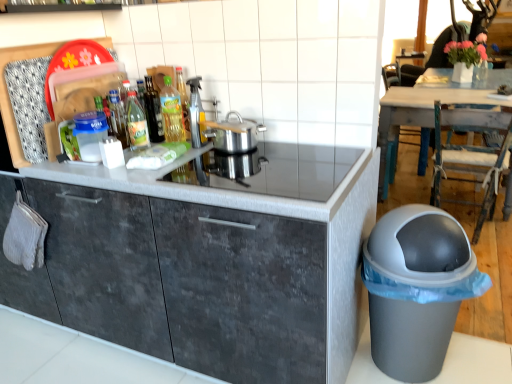
Question: Is rustic wood chair at right, the 2th chair in the back-to-front sequence, positioned with its back to green glass bottle at center, placed as the 3th bottle when sorted from left to right?

Choices:
 (A) no
 (B) yes

Answer: (A)

Question: From a real-world perspective, is rustic wood chair at right, the 2th chair in the back-to-front sequence, positioned under green glass bottle at center, placed as the 1th bottle when sorted from right to left, based on gravity?

Choices:
 (A) yes
 (B) no

Answer: (A)

Question: Is green glass bottle at center, placed as the 3th bottle when sorted from left to right, surrounded by rustic wood chair at right, the 2th chair in the back-to-front sequence?

Choices:
 (A) yes
 (B) no

Answer: (B)

Question: From the image's perspective, is rustic wood chair at right, the 2th chair in the back-to-front sequence, on green glass bottle at center, placed as the 3th bottle when sorted from left to right?

Choices:
 (A) no
 (B) yes

Answer: (A)

Question: From the image's perspective, is rustic wood chair at right, the 2th chair in the back-to-front sequence, below green glass bottle at center, placed as the 1th bottle when sorted from right to left?

Choices:
 (A) no
 (B) yes

Answer: (B)

Question: Does rustic wood chair at right, the 2th chair in the back-to-front sequence, have a lesser width compared to green glass bottle at center, placed as the 1th bottle when sorted from right to left?

Choices:
 (A) no
 (B) yes

Answer: (A)

Question: Does translucent glass bottle at center, the 2th bottle from the left, have a greater width compared to dark gray concrete cabinet at center?

Choices:
 (A) no
 (B) yes

Answer: (A)

Question: From the image's perspective, is translucent glass bottle at center, positioned as the second bottle in right-to-left order, above dark gray concrete cabinet at center?

Choices:
 (A) no
 (B) yes

Answer: (B)

Question: From the image's perspective, does translucent glass bottle at center, positioned as the second bottle in right-to-left order, appear lower than dark gray concrete cabinet at center?

Choices:
 (A) no
 (B) yes

Answer: (A)

Question: Considering the relative sizes of translucent glass bottle at center, positioned as the second bottle in right-to-left order, and dark gray concrete cabinet at center in the image provided, is translucent glass bottle at center, positioned as the second bottle in right-to-left order, smaller than dark gray concrete cabinet at center?

Choices:
 (A) yes
 (B) no

Answer: (A)

Question: Is translucent glass bottle at center, the 2th bottle from the left, facing towards dark gray concrete cabinet at center?

Choices:
 (A) yes
 (B) no

Answer: (B)

Question: Is translucent glass bottle at center, positioned as the second bottle in right-to-left order, at the left side of dark gray concrete cabinet at center?

Choices:
 (A) yes
 (B) no

Answer: (A)

Question: Would you say silver metallic pot at center is part of gray plastic waste bin at lower right's contents?

Choices:
 (A) no
 (B) yes

Answer: (A)